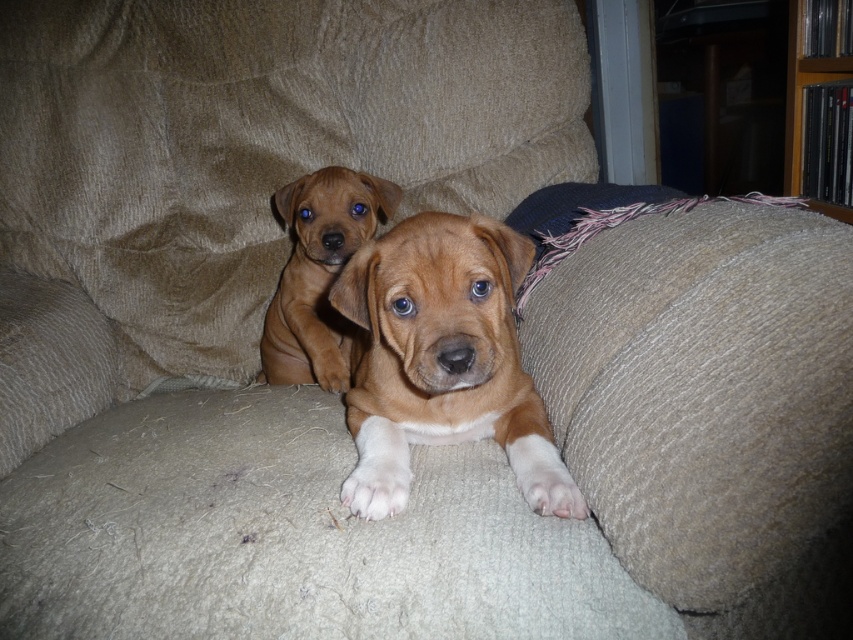
You are a photographer trying to capture a closeup of the smaller puppy. You need to adjust your camera to focus on the smaller puppy. The camera has a focus point at coordinates point [701,388]. Is this focus point positioned over the smaller puppy?

The point [701,388] corresponds to the dark blue textured pillow at right, so the focus point is not positioned over the smaller puppy.

You are a photographer setting up a shoot in the living room. You need to position a tripod so that both the brown furry puppy at center and the wooden bookshelf at upper right are visible in the frame. Based on their positions, where should you place the tripod?

The brown furry puppy at center is below the wooden bookshelf at upper right, so placing the tripod in a position that looks upward towards the bookshelf while keeping the puppy in the lower part of the frame would capture both subjects.

You are a photographer positioned at the center of the couch. You want to place a new camera lens on the dark blue textured pillow at right. Can you estimate if the pillow is located to your left or right side?

The dark blue textured pillow at right is located at the right side of the couch, so from your position at the center, it would be to your right side.